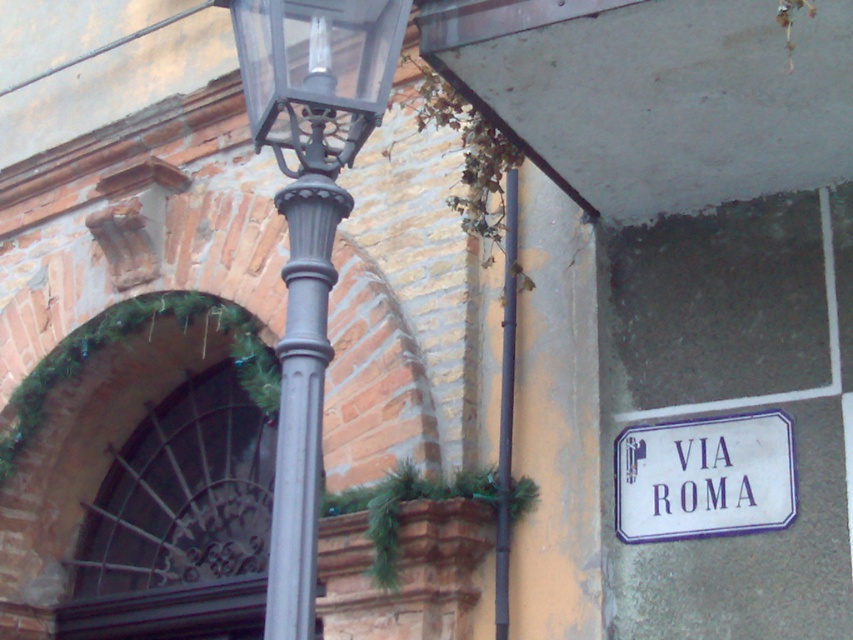
Question: Which point appears farthest from the camera in this image?

Choices:
 (A) (244, 77)
 (B) (328, 209)
 (C) (759, 508)
 (D) (498, 467)

Answer: (D)

Question: From the image, what is the correct spatial relationship of matte black lantern at upper center in relation to white plastic street sign at lower right?

Choices:
 (A) below
 (B) above

Answer: (B)

Question: Which point is closer to the camera?

Choices:
 (A) metallic gray pole at center
 (B) matte black lantern at upper center
 (C) metallic gray pole at right

Answer: (A)

Question: Can you confirm if matte black lantern at upper center is thinner than metallic gray pole at right?

Choices:
 (A) no
 (B) yes

Answer: (A)

Question: Observing the image, what is the correct spatial positioning of matte black street light at center in reference to matte black lantern at upper center?

Choices:
 (A) left
 (B) right

Answer: (B)

Question: Estimate the real-world distances between objects in this image. Which object is farther from the matte black street light at center?

Choices:
 (A) matte black lantern at upper center
 (B) metallic gray pole at right

Answer: (B)